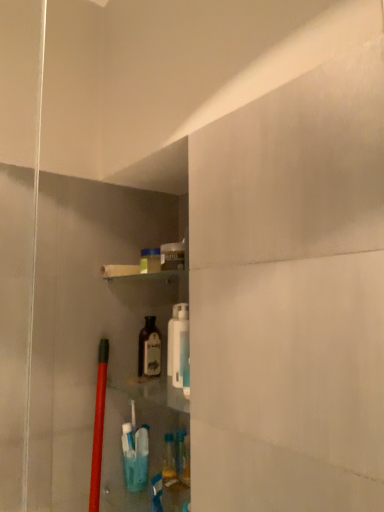
Looking at this image, measure the distance between point (179, 371) and camera.

1.27 meters.

Find the location of a particular element. Image resolution: width=384 pixels, height=512 pixels. white plastic bottle at center is located at coordinates (178, 344).

Describe the element at coordinates (178, 344) in the screenshot. I see `white plastic bottle at center` at that location.

Find the location of a particular element. The width and height of the screenshot is (384, 512). translucent glass bottle at center is located at coordinates (149, 349).

Describe the element at coordinates (149, 349) in the screenshot. Image resolution: width=384 pixels, height=512 pixels. I see `translucent glass bottle at center` at that location.

Measure the distance between point (157, 346) and camera.

They are 1.34 meters apart.

Where is `white plastic bottle at center`? Image resolution: width=384 pixels, height=512 pixels. white plastic bottle at center is located at coordinates (178, 344).

Between translucent glass bottle at center and white plastic bottle at center, which one appears on the right side from the viewer's perspective?

Positioned to the right is white plastic bottle at center.

Based on the photo, is translucent glass bottle at center closer to the viewer compared to white plastic bottle at center?

No, the depth of translucent glass bottle at center is greater than that of white plastic bottle at center.

Is point (155, 371) positioned after point (170, 336)?

Yes, point (155, 371) is behind point (170, 336).

From the image's perspective, would you say translucent glass bottle at center is shown under white plastic bottle at center?

Yes, from the image's perspective, translucent glass bottle at center is below white plastic bottle at center.

From a real-world perspective, which object rests below the other?

translucent glass bottle at center.

Which of these two, translucent glass bottle at center or white plastic bottle at center, is thinner?

white plastic bottle at center is thinner.

Who is shorter, translucent glass bottle at center or white plastic bottle at center?

With less height is translucent glass bottle at center.

Is translucent glass bottle at center bigger than white plastic bottle at center?

No.

Is translucent glass bottle at center spatially inside white plastic bottle at center, or outside of it?

The correct answer is: outside.

Is translucent glass bottle at center not near white plastic bottle at center?

That's not correct — translucent glass bottle at center is a little close to white plastic bottle at center.

Is translucent glass bottle at center facing away from white plastic bottle at center?

No, white plastic bottle at center is not at the back of translucent glass bottle at center.

Can you tell me how much translucent glass bottle at center and white plastic bottle at center differ in facing direction?

The angular difference between translucent glass bottle at center and white plastic bottle at center is 0.0034 degrees.

Measure the distance from translucent glass bottle at center to white plastic bottle at center.

A distance of 4.05 inches exists between translucent glass bottle at center and white plastic bottle at center.

Locate an element on the screen. The width and height of the screenshot is (384, 512). cleaning product in front of the translucent glass bottle at center is located at coordinates (178, 344).

In the image, is white plastic bottle at center on the left side or the right side of translucent glass bottle at center?

white plastic bottle at center is to the right of translucent glass bottle at center.

Relative to translucent glass bottle at center, is white plastic bottle at center in front or behind?

white plastic bottle at center is in front of translucent glass bottle at center.

Considering the positions of points (184, 358) and (148, 357), is point (184, 358) farther from camera compared to point (148, 357)?

No.

From the image's perspective, would you say white plastic bottle at center is shown under translucent glass bottle at center?

No, from the image's perspective, white plastic bottle at center is not beneath translucent glass bottle at center.

From a real-world perspective, which object stands above the other?

→ In real-world perspective, white plastic bottle at center is above.

Between white plastic bottle at center and translucent glass bottle at center, which one has smaller width?

white plastic bottle at center is thinner.

Does white plastic bottle at center have a greater height compared to translucent glass bottle at center?

Yes.

Does white plastic bottle at center have a larger size compared to translucent glass bottle at center?

Correct, white plastic bottle at center is larger in size than translucent glass bottle at center.

Consider the image. Could translucent glass bottle at center be considered to be inside white plastic bottle at center?

No, translucent glass bottle at center is not inside white plastic bottle at center.

Is white plastic bottle at center not close to translucent glass bottle at center?

No, white plastic bottle at center is not far away from translucent glass bottle at center.

Is white plastic bottle at center aimed at translucent glass bottle at center?

No, white plastic bottle at center does not turn towards translucent glass bottle at center.

I want to click on bottle behind the white plastic bottle at center, so click(149, 349).

You are a GUI agent. You are given a task and a screenshot of the screen. Output one action in this format:
    pyautogui.click(x=<x>, y=<y>)
    Task: Click on the cleaning product on the right of translucent glass bottle at center
    
    Given the screenshot: What is the action you would take?
    pyautogui.click(x=178, y=344)

The width and height of the screenshot is (384, 512). In order to click on bottle on the left of white plastic bottle at center in this screenshot , I will do 149,349.